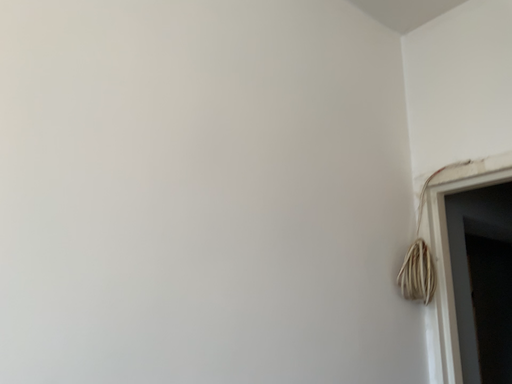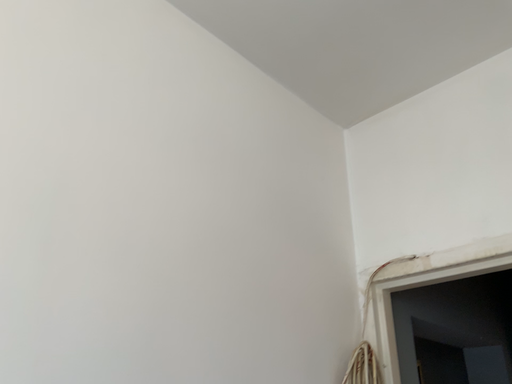
Question: How did the camera likely rotate when shooting the video?

Choices:
 (A) rotated downward
 (B) rotated upward

Answer: (B)